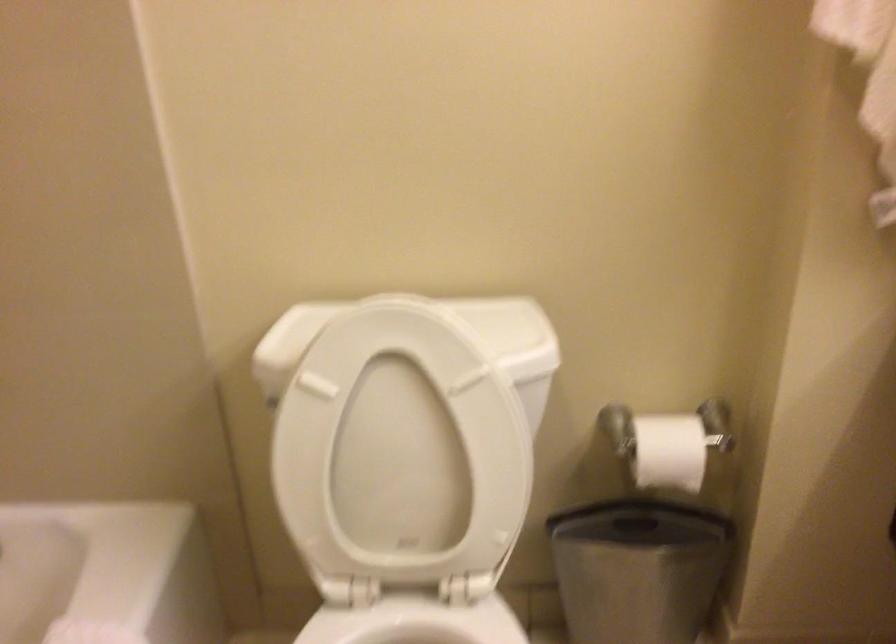
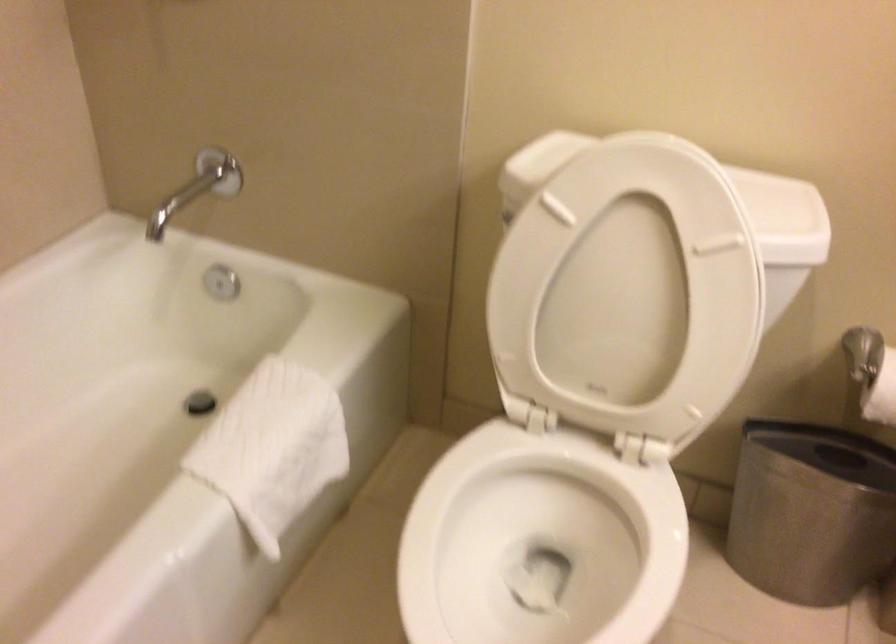
The point at (x=410, y=439) is marked in the first image. Where is the corresponding point in the second image?

(633, 285)